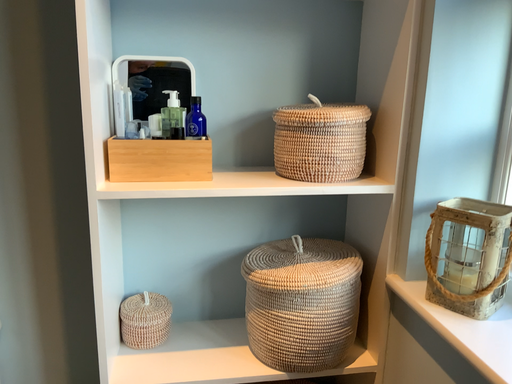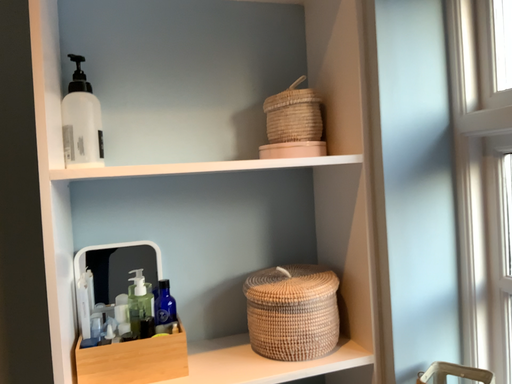
Question: How did the camera likely rotate when shooting the video?

Choices:
 (A) rotated right
 (B) rotated left

Answer: (A)